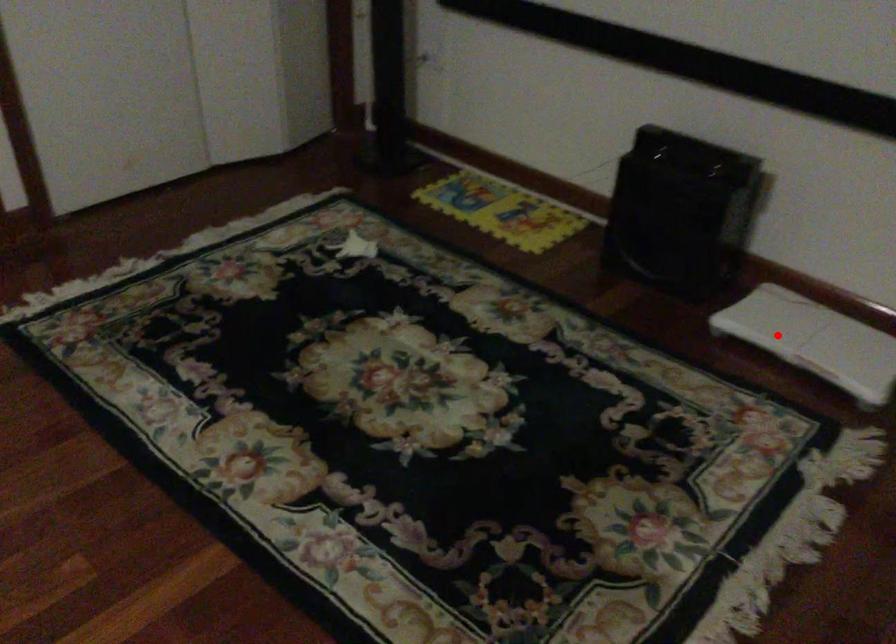
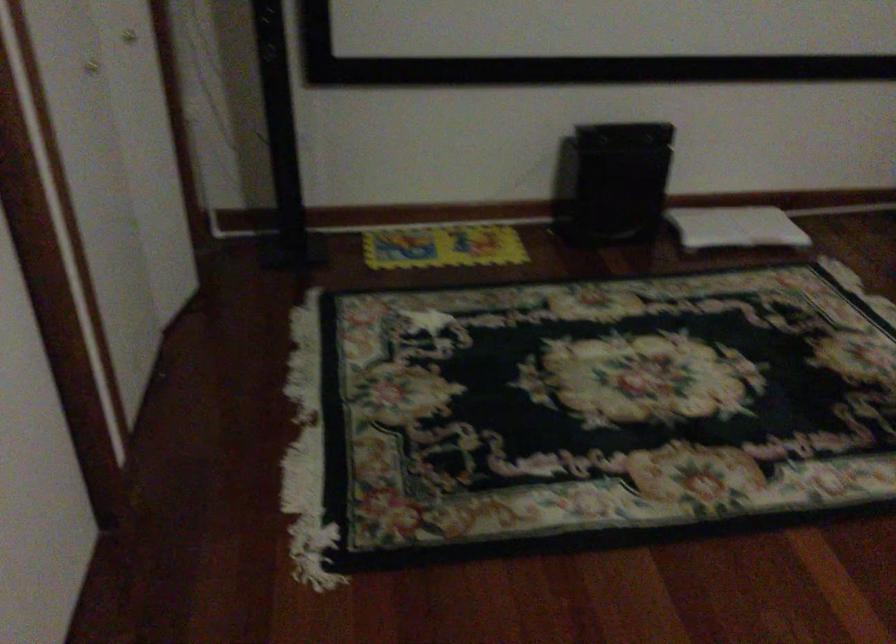
Question: I am providing you with two images of the same scene from different viewpoints. Given a red point in image1, look at the same physical point in image2. Is it:

Choices:
 (A) Closer to the viewpoint
 (B) Farther from the viewpoint

Answer: (B)